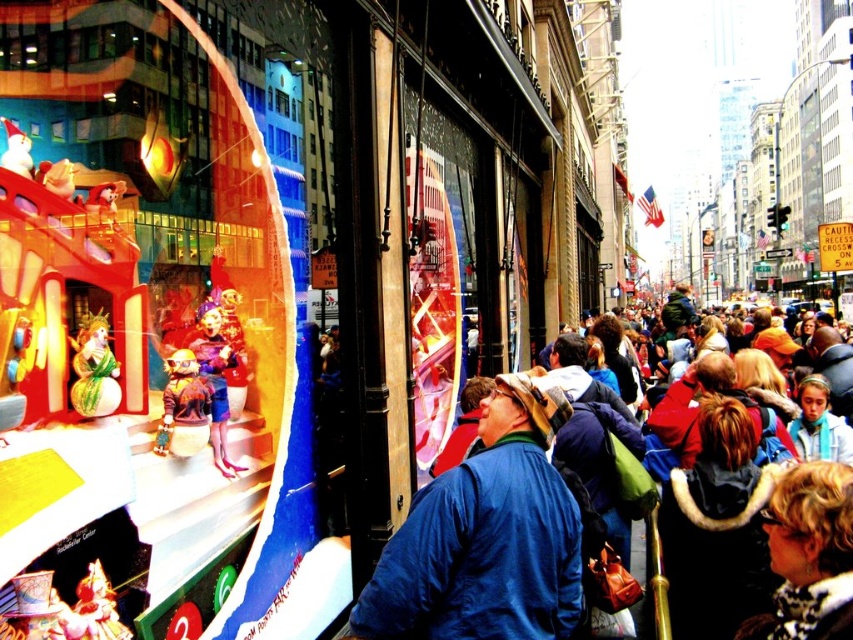
Is plush teddy bear at left closer to camera compared to shiny gold snowman at center?

No.

Between plush teddy bear at left and shiny gold snowman at center, which one appears on the left side from the viewer's perspective?

From the viewer's perspective, shiny gold snowman at center appears more on the left side.

Which is behind, point (157, 448) or point (119, 193)?

Point (157, 448)

Where is `plush teddy bear at left`? plush teddy bear at left is located at coordinates (183, 406).

Does matte green snowman at left have a larger size compared to matte plastic clown at center?

Yes, matte green snowman at left is bigger than matte plastic clown at center.

Does matte green snowman at left appear on the left side of matte plastic clown at center?

Correct, you'll find matte green snowman at left to the left of matte plastic clown at center.

Does point (84, 410) lie behind point (209, 404)?

No, it is in front of (209, 404).

The image size is (853, 640). I want to click on matte green snowman at left, so click(x=94, y=369).

Is the position of blue fabric jacket at center less distant than that of curly blonde hair at center?

No, it is not.

Between point (494, 417) and point (845, 474), which one is positioned behind?

Positioned behind is point (494, 417).

Locate an element on the screen. Image resolution: width=853 pixels, height=640 pixels. blue fabric jacket at center is located at coordinates (485, 538).